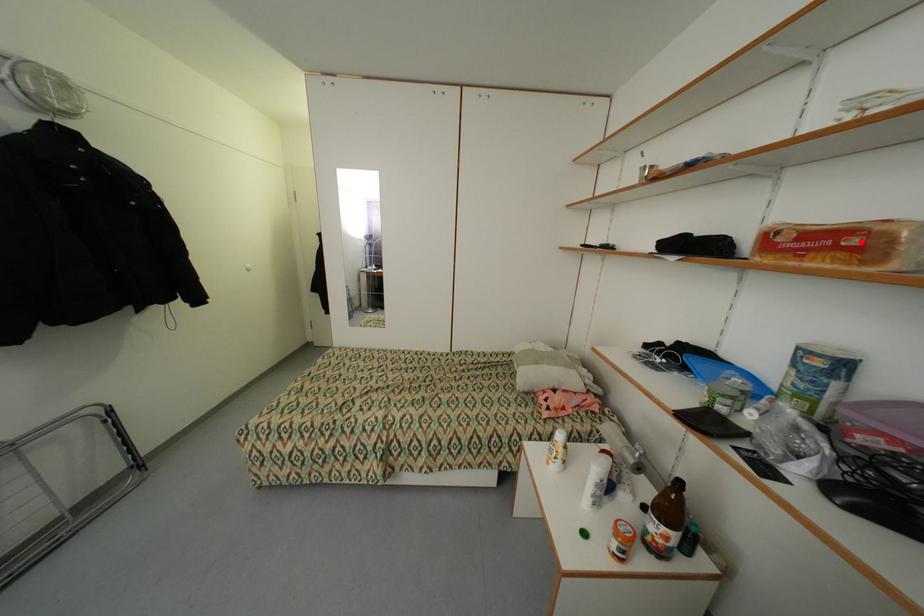
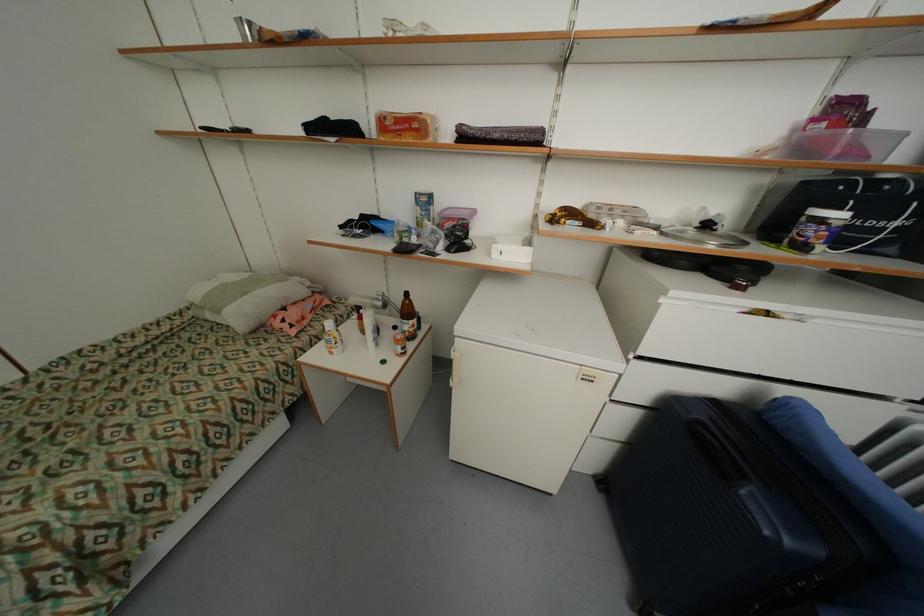
Find the pixel in the second image that matches the highlighted location in the first image.

(421, 126)